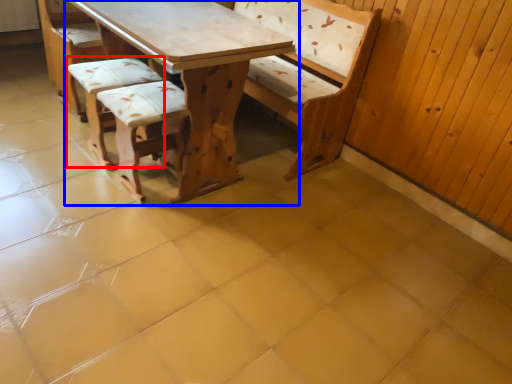
Question: Which object is closer to the camera taking this photo, armchair (highlighted by a red box) or table (highlighted by a blue box)?

Choices:
 (A) armchair
 (B) table

Answer: (B)